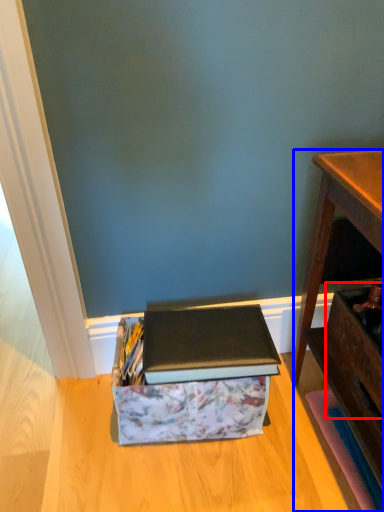
Question: Which object appears farthest to the camera in this image, drawer (highlighted by a red box) or desk (highlighted by a blue box)?

Choices:
 (A) drawer
 (B) desk

Answer: (A)